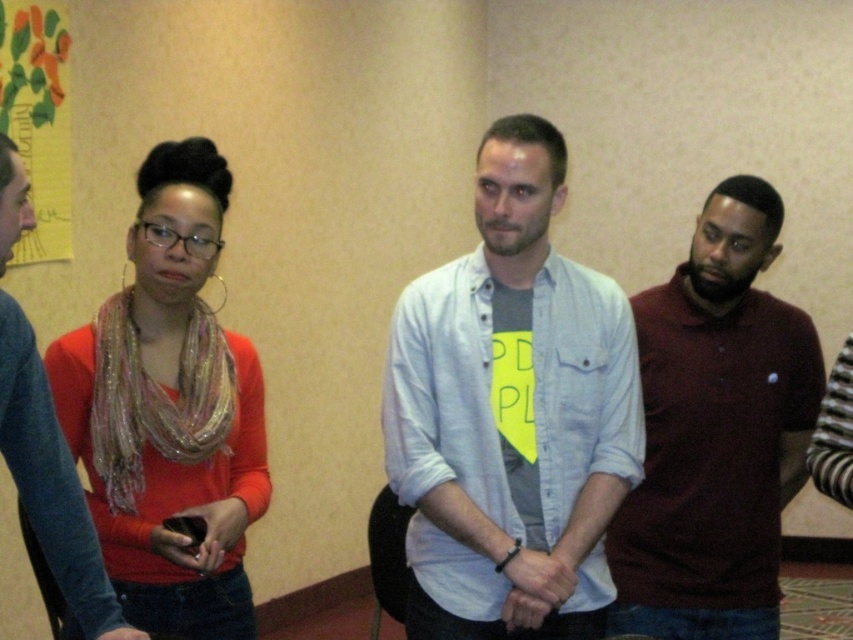
Question: Is light blue denim shirt at center smaller than maroon polo shirt at right?

Choices:
 (A) yes
 (B) no

Answer: (B)

Question: Considering the real-world distances, which object is farthest from the maroon polo shirt at right?

Choices:
 (A) light blue denim shirt at center
 (B) matte orange sweater at left

Answer: (B)

Question: Which is nearer to the light blue denim shirt at center?

Choices:
 (A) matte orange sweater at left
 (B) maroon polo shirt at right

Answer: (B)

Question: Is light blue denim shirt at center to the left of matte orange sweater at left from the viewer's perspective?

Choices:
 (A) no
 (B) yes

Answer: (A)

Question: Can you confirm if light blue denim shirt at center is bigger than maroon polo shirt at right?

Choices:
 (A) yes
 (B) no

Answer: (A)

Question: Which point appears closest to the camera in this image?

Choices:
 (A) (587, 461)
 (B) (755, 568)

Answer: (A)